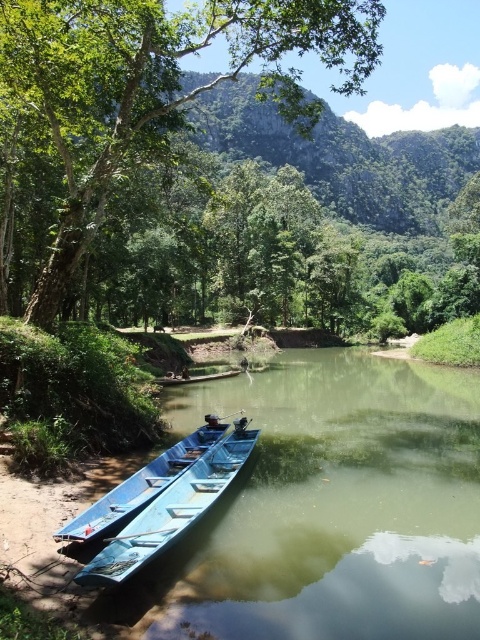
Can you confirm if green leafy tree at center is wider than blue wooden boat at lower left?

Yes, green leafy tree at center is wider than blue wooden boat at lower left.

Which is behind, point (372, 64) or point (210, 493)?

Point (372, 64)

This screenshot has width=480, height=640. I want to click on green leafy tree at center, so click(155, 84).